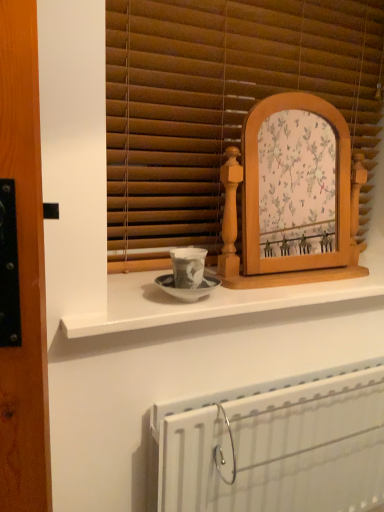
What do you see at coordinates (285, 222) in the screenshot?
I see `wooden picture frame at center` at bounding box center [285, 222].

Image resolution: width=384 pixels, height=512 pixels. What do you see at coordinates (274, 445) in the screenshot?
I see `white metallic radiator at lower center` at bounding box center [274, 445].

Where is `white glossy counter at center`? white glossy counter at center is located at coordinates (215, 298).

This screenshot has width=384, height=512. What do you see at coordinates (215, 298) in the screenshot?
I see `white glossy counter at center` at bounding box center [215, 298].

The width and height of the screenshot is (384, 512). Find the location of `wooden picture frame at center`. wooden picture frame at center is located at coordinates (285, 222).

Who is shorter, wooden blinds at center or wooden picture frame at center?

Standing shorter between the two is wooden picture frame at center.

Would you consider wooden blinds at center to be distant from wooden picture frame at center?

That's not correct — wooden blinds at center is a little close to wooden picture frame at center.

Is wooden blinds at center wider or thinner than wooden picture frame at center?

In the image, wooden blinds at center appears to be more narrow than wooden picture frame at center.

Based on the photo, can you confirm if wooden picture frame at center is positioned to the right of white metallic radiator at lower center?

Indeed, wooden picture frame at center is positioned on the right side of white metallic radiator at lower center.

Is wooden picture frame at center taller than white metallic radiator at lower center?

Incorrect, the height of wooden picture frame at center is not larger of that of white metallic radiator at lower center.

Considering the positions of points (282, 256) and (229, 444), is point (282, 256) closer to camera compared to point (229, 444)?

No.

Which object is wider, wooden picture frame at center or white metallic radiator at lower center?

With larger width is white metallic radiator at lower center.

From a real-world perspective, between white metallic radiator at lower center and white glossy counter at center, who is vertically lower?

white metallic radiator at lower center.

From the image's perspective, is white metallic radiator at lower center positioned above or below white glossy counter at center?

Based on their image positions, white metallic radiator at lower center is located beneath white glossy counter at center.

Between white metallic radiator at lower center and white glossy counter at center, which one has larger width?

Wider between the two is white glossy counter at center.

Would you say white metallic radiator at lower center is to the left or to the right of white glossy counter at center in the picture?

From the image, it's evident that white metallic radiator at lower center is to the right of white glossy counter at center.

Does white glossy counter at center appear on the left side of wooden blinds at center?

Correct, you'll find white glossy counter at center to the left of wooden blinds at center.

Based on the photo, is white glossy counter at center oriented towards wooden blinds at center?

No, white glossy counter at center is not turned towards wooden blinds at center.

Considering the sizes of objects white glossy counter at center and wooden blinds at center in the image provided, who is thinner, white glossy counter at center or wooden blinds at center?

Thinner between the two is wooden blinds at center.

This screenshot has height=512, width=384. Find the location of `window blind on the right of white glossy counter at center`. window blind on the right of white glossy counter at center is located at coordinates (220, 103).

Is white glossy counter at center positioned with its back to white metallic radiator at lower center?

white glossy counter at center does not have its back to white metallic radiator at lower center.

Is white glossy counter at center closer to the viewer compared to white metallic radiator at lower center?

Yes, the depth of white glossy counter at center is less than that of white metallic radiator at lower center.

Consider the image. Can you confirm if white glossy counter at center is shorter than white metallic radiator at lower center?

Yes, white glossy counter at center is shorter than white metallic radiator at lower center.

Which object is more forward, wooden blinds at center or white glossy counter at center?

white glossy counter at center.

Could white glossy counter at center be considered to be inside wooden blinds at center?

No, white glossy counter at center is not a part of wooden blinds at center.

Based on the photo, considering the relative positions of wooden blinds at center and white glossy counter at center in the image provided, is wooden blinds at center to the left of white glossy counter at center from the viewer's perspective?

No.

I want to click on counter located in front of the wooden blinds at center, so click(x=215, y=298).

Considering the relative sizes of white glossy counter at center and wooden picture frame at center in the image provided, is white glossy counter at center smaller than wooden picture frame at center?

Yes, white glossy counter at center is smaller than wooden picture frame at center.

Looking at this image, considering the sizes of white glossy counter at center and wooden picture frame at center in the image, is white glossy counter at center wider or thinner than wooden picture frame at center?

In the image, white glossy counter at center appears to be wider than wooden picture frame at center.

Where is `counter on the left of wooden picture frame at center`? counter on the left of wooden picture frame at center is located at coordinates (215, 298).

Where is `window blind located behind the wooden picture frame at center`? window blind located behind the wooden picture frame at center is located at coordinates (220, 103).

Find the location of a particular element. This screenshot has width=384, height=512. picture frame on the right of the white metallic radiator at lower center is located at coordinates (285, 222).

Looking at the image, which one is located further to wooden blinds at center, white metallic radiator at lower center or white glossy counter at center?

Among the two, white metallic radiator at lower center is located further to wooden blinds at center.

From the image, which object appears to be farther from wooden blinds at center, wooden picture frame at center or white metallic radiator at lower center?

Based on the image, white metallic radiator at lower center appears to be further to wooden blinds at center.

When comparing their distances from wooden picture frame at center, does white metallic radiator at lower center or wooden blinds at center seem closer?

Based on the image, wooden blinds at center appears to be nearer to wooden picture frame at center.

Which object lies further to the anchor point white metallic radiator at lower center, wooden picture frame at center or wooden blinds at center?

Based on the image, wooden blinds at center appears to be further to white metallic radiator at lower center.

Estimate the real-world distances between objects in this image. Which object is closer to white glossy counter at center, white metallic radiator at lower center or wooden blinds at center?

Based on the image, white metallic radiator at lower center appears to be nearer to white glossy counter at center.

Looking at the image, which one is located closer to wooden blinds at center, wooden picture frame at center or white glossy counter at center?

wooden picture frame at center is closer to wooden blinds at center.

Estimate the real-world distances between objects in this image. Which object is further from white glossy counter at center, wooden blinds at center or wooden picture frame at center?

The object further to white glossy counter at center is wooden blinds at center.

Which object lies further to the anchor point white glossy counter at center, wooden blinds at center or white metallic radiator at lower center?

wooden blinds at center lies further to white glossy counter at center than the other object.

Locate an element on the screen. picture frame between wooden blinds at center and white metallic radiator at lower center from top to bottom is located at coordinates (285, 222).

In order to click on picture frame between wooden blinds at center and white glossy counter at center from top to bottom in this screenshot , I will do `click(285, 222)`.

Locate an element on the screen. The image size is (384, 512). counter between wooden picture frame at center and white metallic radiator at lower center vertically is located at coordinates (215, 298).

Where is `counter between wooden blinds at center and white metallic radiator at lower center vertically`? The height and width of the screenshot is (512, 384). counter between wooden blinds at center and white metallic radiator at lower center vertically is located at coordinates (215, 298).